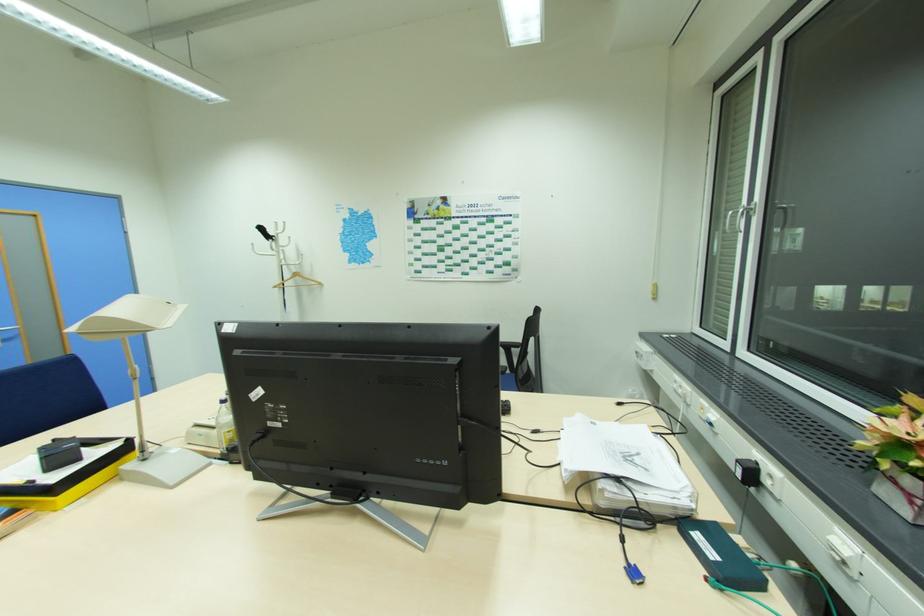
The location [897,455] corresponds to which object?

It refers to a small potted plant.